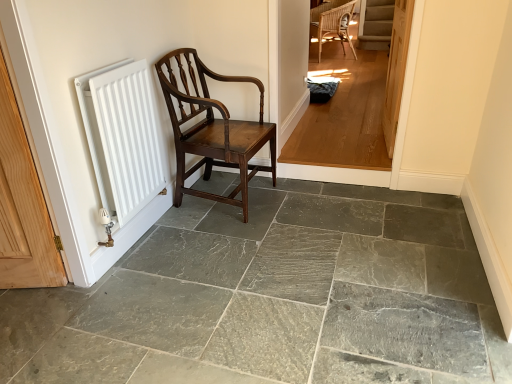
At what (x,y) coordinates should I click in order to perform the action: click on vacant space underneath polished dark wood chair at left (from a real-world perspective). Please return your answer as a coordinate pair (x, y). Looking at the image, I should click on (226, 194).